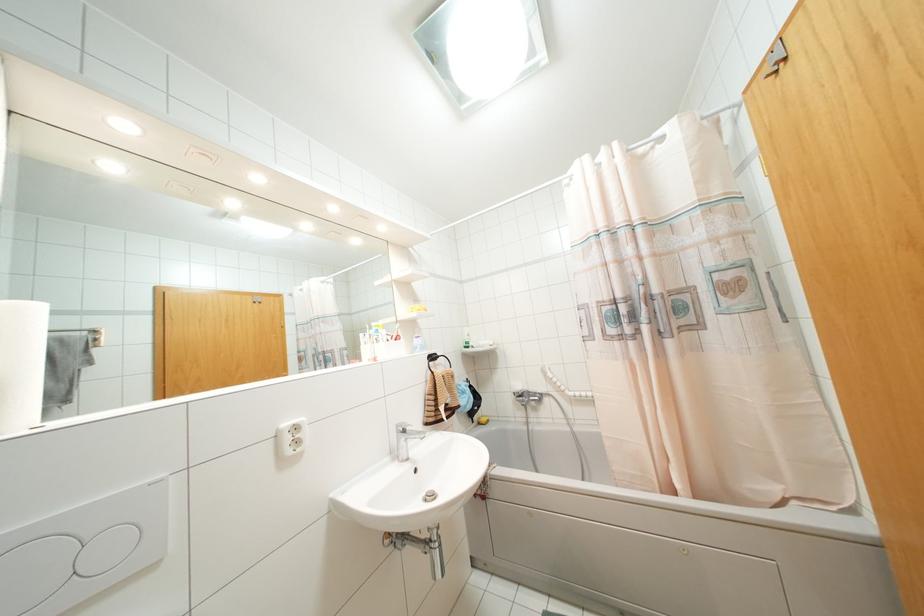
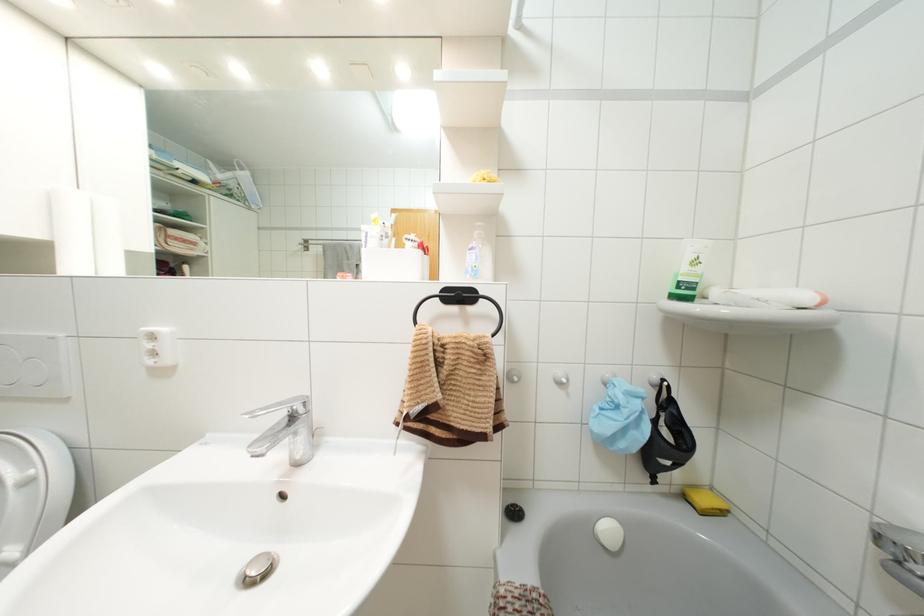
The point at (x=479, y=423) is marked in the first image. Where is the corresponding point in the second image?

(685, 496)